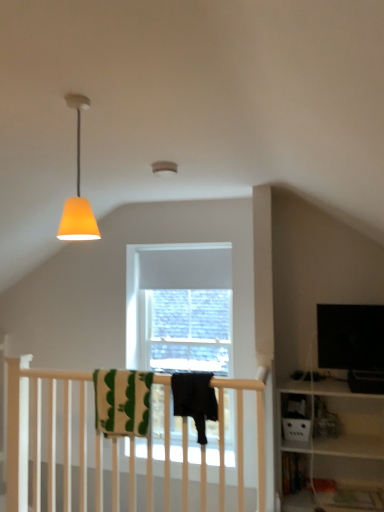
Question: Does point (74, 211) appear closer or farther from the camera than point (109, 386)?

Choices:
 (A) closer
 (B) farther

Answer: (A)

Question: Visually, is orange matte lampshade at upper left positioned to the left or to the right of green striped towel at center, the 1th beach towel in the left-to-right sequence?

Choices:
 (A) left
 (B) right

Answer: (B)

Question: Which object is the farthest from the green striped towel at center, which is counted as the second beach towel, starting from the right?

Choices:
 (A) black cotton towel at center, acting as the 1th beach towel starting from the right
 (B) orange matte lampshade at upper left

Answer: (B)

Question: Which object is positioned closest to the black cotton towel at center, placed as the 2th beach towel when sorted from left to right?

Choices:
 (A) green striped towel at center, the 1th beach towel in the left-to-right sequence
 (B) orange matte lampshade at upper left

Answer: (A)